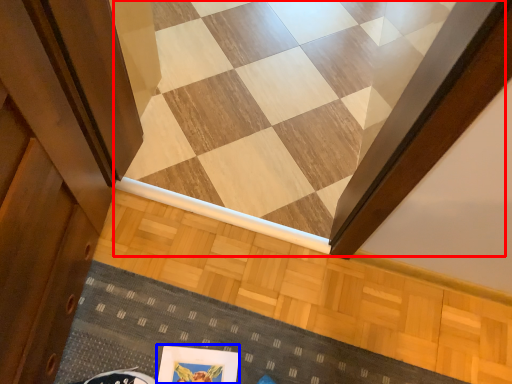
Question: Among these objects, which one is farthest to the camera, stairwell (highlighted by a red box) or picture frame (highlighted by a blue box)?

Choices:
 (A) stairwell
 (B) picture frame

Answer: (A)